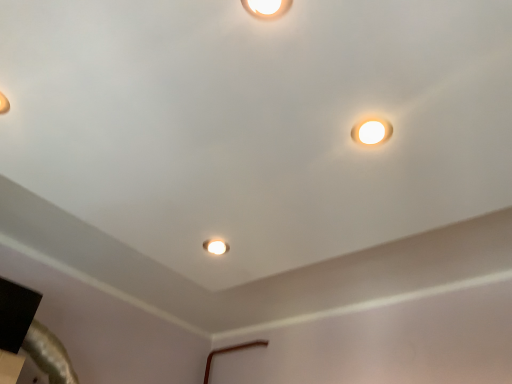
Question: In terms of width, does matte white lamp at upper right look wider or thinner when compared to matte white ceiling light at center?

Choices:
 (A) wide
 (B) thin

Answer: (A)

Question: In terms of height, does matte white lamp at upper right look taller or shorter compared to matte white ceiling light at center?

Choices:
 (A) tall
 (B) short

Answer: (B)

Question: Is point (374, 130) positioned closer to the camera than point (202, 244)?

Choices:
 (A) farther
 (B) closer

Answer: (B)

Question: Based on their positions, is matte white ceiling light at center located to the left or right of matte white lamp at upper right?

Choices:
 (A) left
 (B) right

Answer: (A)

Question: From their relative heights in the image, would you say matte white ceiling light at center is taller or shorter than matte white lamp at upper right?

Choices:
 (A) tall
 (B) short

Answer: (A)

Question: From a real-world perspective, is matte white ceiling light at center positioned above or below matte white lamp at upper right?

Choices:
 (A) below
 (B) above

Answer: (B)

Question: Considering the positions of point (221, 241) and point (360, 135), is point (221, 241) closer or farther from the camera than point (360, 135)?

Choices:
 (A) farther
 (B) closer

Answer: (A)